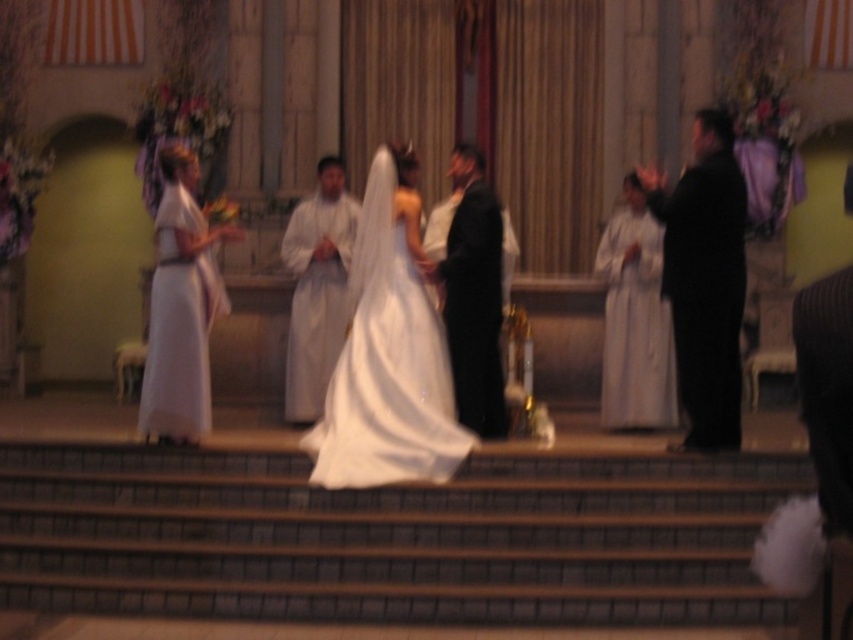
Is smooth stone stairs at center thinner than white satin dress at center?

No, smooth stone stairs at center is not thinner than white satin dress at center.

Does point (457, 486) come farther from viewer compared to point (349, 369)?

No, it is in front of (349, 369).

Between point (706, 588) and point (334, 433), which one is positioned in front?

Point (706, 588) is in front.

Locate an element on the screen. The image size is (853, 640). smooth stone stairs at center is located at coordinates (390, 538).

Who is higher up, black satin suit at right or white satin dress at right?

black satin suit at right is higher up.

Between point (709, 401) and point (640, 378), which one is positioned behind?

Positioned behind is point (640, 378).

Image resolution: width=853 pixels, height=640 pixels. I want to click on black satin suit at right, so click(x=704, y=280).

This screenshot has width=853, height=640. Describe the element at coordinates (635, 324) in the screenshot. I see `white satin dress at right` at that location.

Between point (630, 381) and point (288, 234), which one is positioned behind?

Point (288, 234)

The image size is (853, 640). I want to click on white satin dress at right, so click(x=635, y=324).